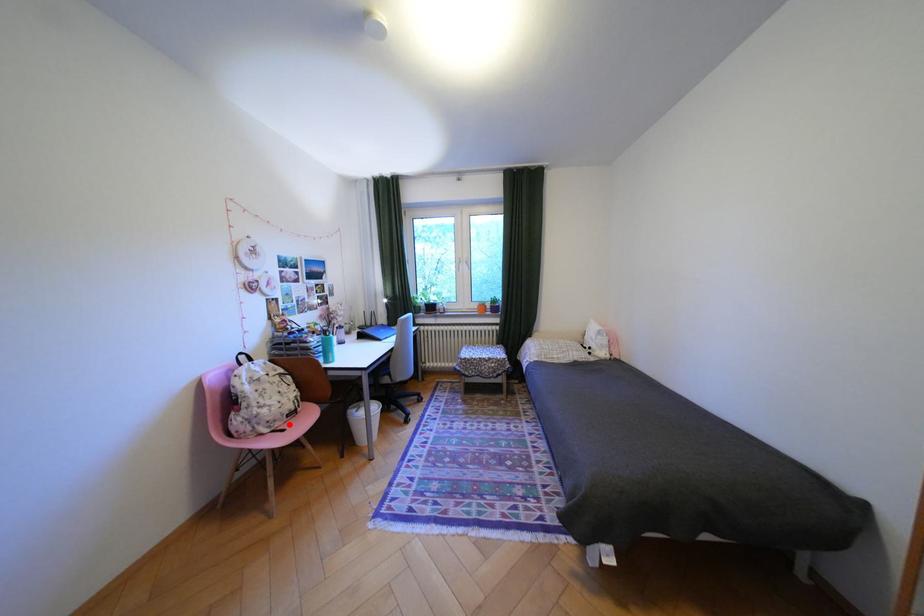
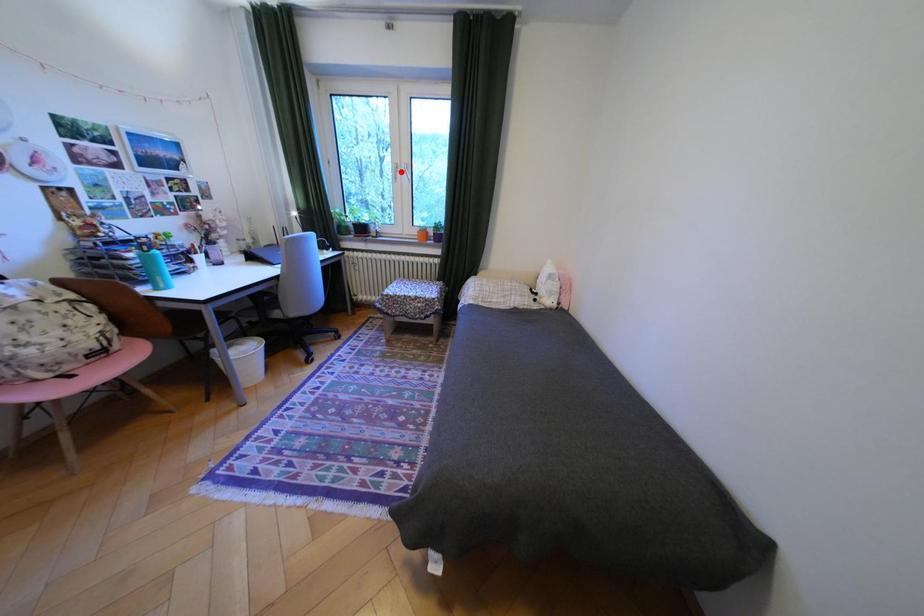
I am providing you with two images of the same scene from different viewpoints. A red point is marked on the first image and another point is marked on the second image. Is the marked point in image1 the same physical position as the marked point in image2?

No